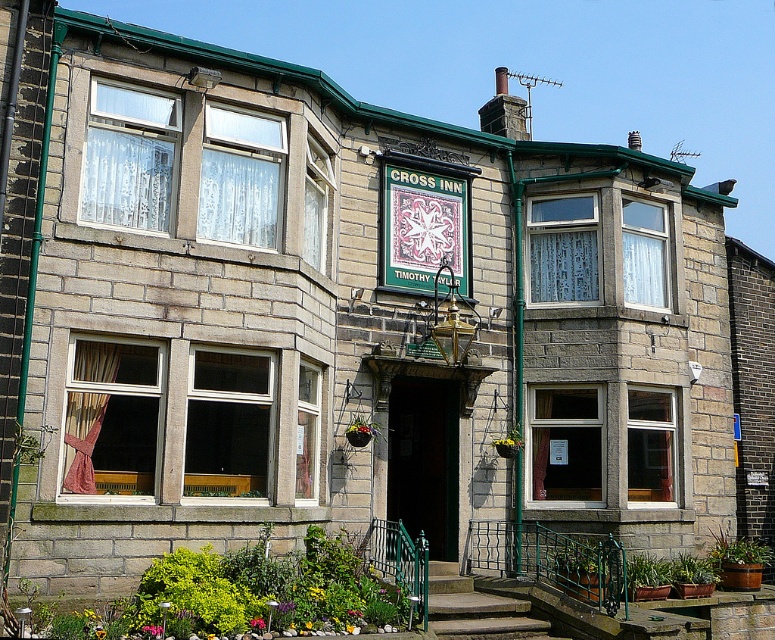
Can you confirm if green fabric sign at center is wider than concrete steps at center?

In fact, green fabric sign at center might be narrower than concrete steps at center.

Which is more to the left, green fabric sign at center or concrete steps at center?

Positioned to the left is green fabric sign at center.

Between point (419, 200) and point (512, 636), which one is positioned behind?

Point (419, 200)

I want to click on green fabric sign at center, so click(x=422, y=227).